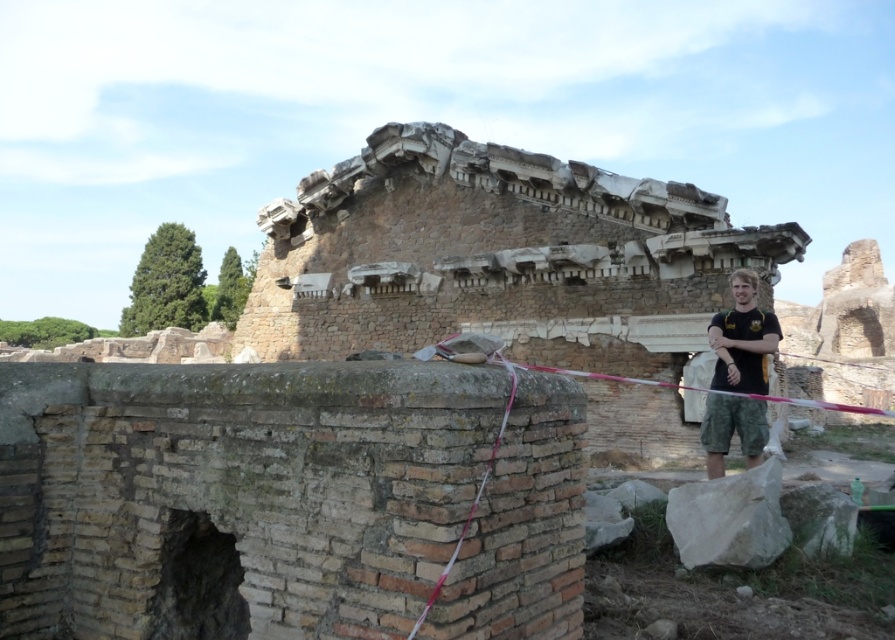
Which is below, camouflage shorts at right or pink fabric rope at center?

camouflage shorts at right is below.

Is point (763, 332) less distant than point (456, 552)?

No, (763, 332) is further to viewer.

You are a GUI agent. You are given a task and a screenshot of the screen. Output one action in this format:
    pyautogui.click(x=<x>, y=<y>)
    Task: Click on the camouflage shorts at right
    
    Given the screenshot: What is the action you would take?
    pyautogui.click(x=742, y=339)